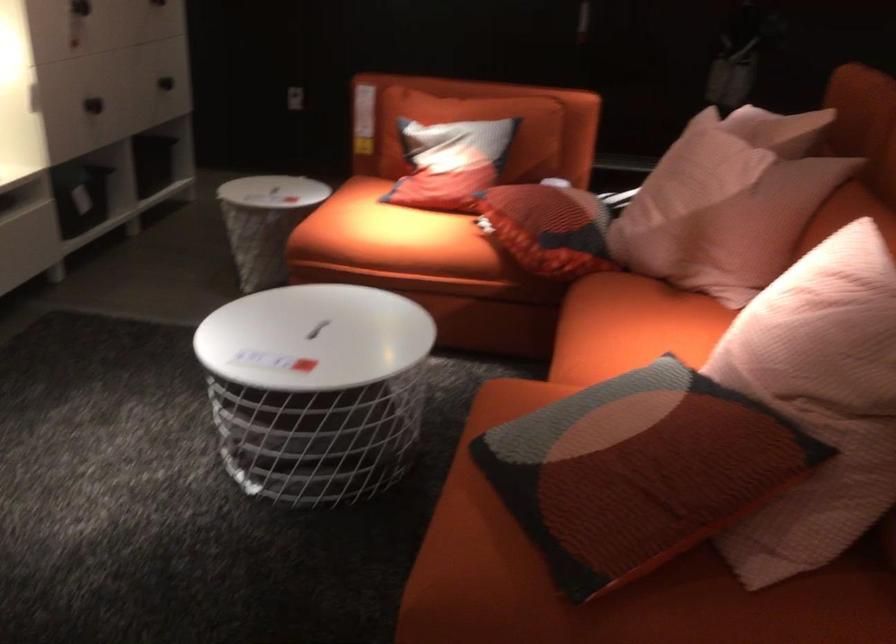
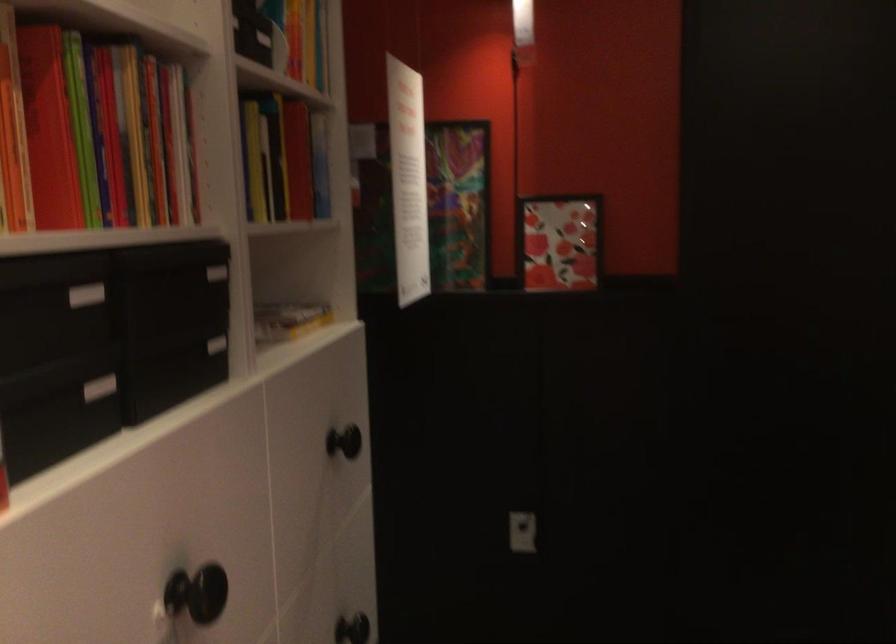
In the second image, find the point that corresponds to the point at 168,71 in the first image.

(351, 629)